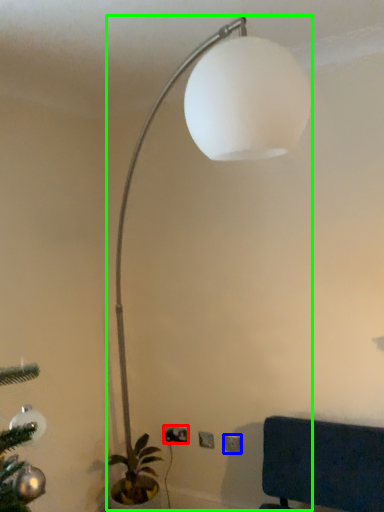
Question: Estimate the real-world distances between objects in this image. Which object is farther from electric outlet (highlighted by a red box), electric outlet (highlighted by a blue box) or lamp (highlighted by a green box)?

Choices:
 (A) electric outlet
 (B) lamp

Answer: (B)